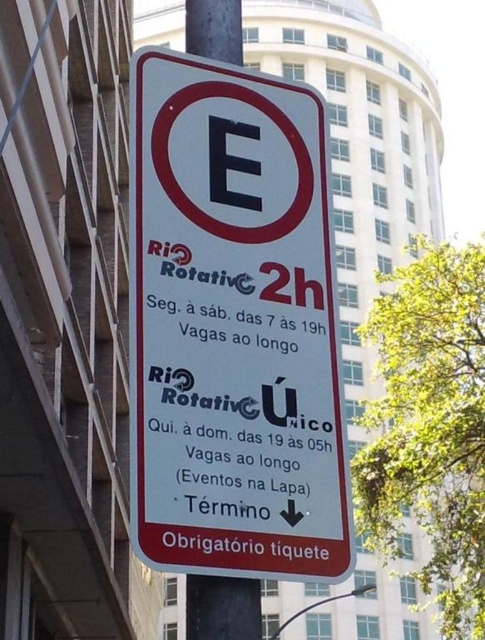
Does white plastic sign at center come behind black metal pole at center?

No, it is not.

Is white plastic sign at center closer to camera compared to black metal pole at center?

Yes, it is in front of black metal pole at center.

Who is more distant from viewer, (255, 292) or (255, 634)?

Point (255, 292)

Identify the location of white plastic sign at center. (232, 326).